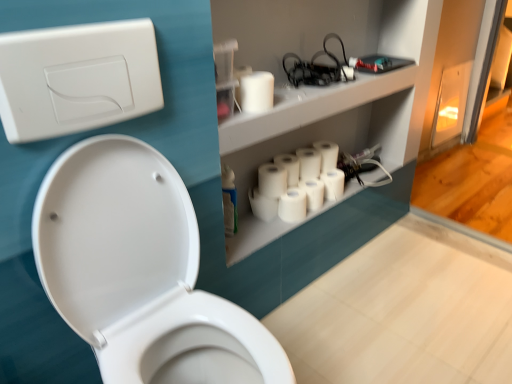
Question: Considering the relative sizes of white matte toilet paper at center, the 6th toilet paper in the back-to-front sequence, and white matte toilet paper at center, positioned as the 2th toilet paper in back-to-front order, in the image provided, is white matte toilet paper at center, the 6th toilet paper in the back-to-front sequence, smaller than white matte toilet paper at center, positioned as the 2th toilet paper in back-to-front order,?

Choices:
 (A) no
 (B) yes

Answer: (B)

Question: From a real-world perspective, is white matte toilet paper at center, the 6th toilet paper in the back-to-front sequence, located higher than white matte toilet paper at center, positioned as the 2th toilet paper in back-to-front order?

Choices:
 (A) no
 (B) yes

Answer: (A)

Question: From the image's perspective, is white matte toilet paper at center, the 6th toilet paper in the back-to-front sequence, below white matte toilet paper at center, positioned as the 2th toilet paper in back-to-front order?

Choices:
 (A) yes
 (B) no

Answer: (A)

Question: Is white matte toilet paper at center, the 6th toilet paper in the back-to-front sequence, wider than white matte toilet paper at center, positioned as the 2th toilet paper in back-to-front order?

Choices:
 (A) yes
 (B) no

Answer: (A)

Question: Considering the relative positions of white matte toilet paper at center, acting as the fourth toilet paper starting from the front, and white matte toilet paper at center, positioned as the 2th toilet paper in back-to-front order, in the image provided, is white matte toilet paper at center, acting as the fourth toilet paper starting from the front, behind white matte toilet paper at center, positioned as the 2th toilet paper in back-to-front order,?

Choices:
 (A) yes
 (B) no

Answer: (B)

Question: Is white matte toilet paper at center, acting as the fourth toilet paper starting from the front, not inside white matte toilet paper at center, positioned as the 2th toilet paper in back-to-front order?

Choices:
 (A) no
 (B) yes

Answer: (B)

Question: From a real-world perspective, does white matte toilet paper at center, which is the seventh toilet paper from back to front, stand above white matte toilet paper at center, the 4th toilet paper viewed from the back?

Choices:
 (A) no
 (B) yes

Answer: (B)

Question: Is white matte toilet paper at center, which is the seventh toilet paper from back to front, thinner than white matte toilet paper at center, positioned as the sixth toilet paper in front-to-back order?

Choices:
 (A) yes
 (B) no

Answer: (A)

Question: Is white matte toilet paper at center, which is the seventh toilet paper from back to front, to the right of white matte toilet paper at center, the 4th toilet paper viewed from the back, from the viewer's perspective?

Choices:
 (A) yes
 (B) no

Answer: (B)

Question: Can you confirm if white matte toilet paper at center, placed as the 3th toilet paper when sorted from front to back, is smaller than white matte toilet paper at center, positioned as the sixth toilet paper in front-to-back order?

Choices:
 (A) yes
 (B) no

Answer: (A)

Question: Is the position of white matte toilet paper at center, placed as the 3th toilet paper when sorted from front to back, more distant than that of white matte toilet paper at center, the 4th toilet paper viewed from the back?

Choices:
 (A) yes
 (B) no

Answer: (B)

Question: Is the depth of white matte toilet paper at center, placed as the 3th toilet paper when sorted from front to back, less than that of white matte toilet paper at center, the 4th toilet paper viewed from the back?

Choices:
 (A) no
 (B) yes

Answer: (B)

Question: Is there a large distance between white matte toilet paper at upper center, the 1th toilet paper positioned from the front, and white matte toilet paper at center, the 4th toilet paper viewed from the back?

Choices:
 (A) yes
 (B) no

Answer: (B)